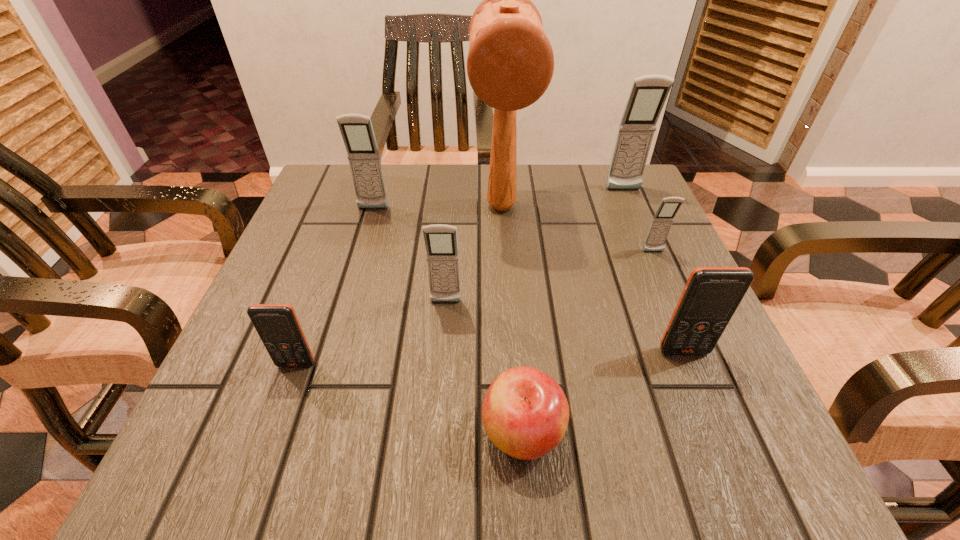
The image size is (960, 540). I want to click on the tallest object, so click(x=510, y=63).

Where is `the biggest gray cellular telephone`? This screenshot has height=540, width=960. the biggest gray cellular telephone is located at coordinates (648, 94).

This screenshot has width=960, height=540. Identify the location of the farthest cellular telephone. (648, 94).

The height and width of the screenshot is (540, 960). I want to click on the second farthest cellular telephone, so click(357, 132).

At what (x,y) coordinates should I click in order to perform the action: click on the second tallest cellular telephone. Please return your answer as a coordinate pair (x, y). Looking at the image, I should click on (357, 132).

Image resolution: width=960 pixels, height=540 pixels. Identify the location of the sixth object from right to left. (441, 243).

You are a GUI agent. You are given a task and a screenshot of the screen. Output one action in this format:
    pyautogui.click(x=<x>, y=<y>)
    Task: Click on the second smallest gray cellular telephone
    Image resolution: width=960 pixels, height=540 pixels.
    Given the screenshot: What is the action you would take?
    pyautogui.click(x=441, y=243)

In order to click on the sixth farthest object in this screenshot , I will do `click(711, 296)`.

I want to click on the right orange cellular telephone, so click(x=711, y=296).

Where is `the nearest cellular telephone`? The width and height of the screenshot is (960, 540). the nearest cellular telephone is located at coordinates (277, 325).